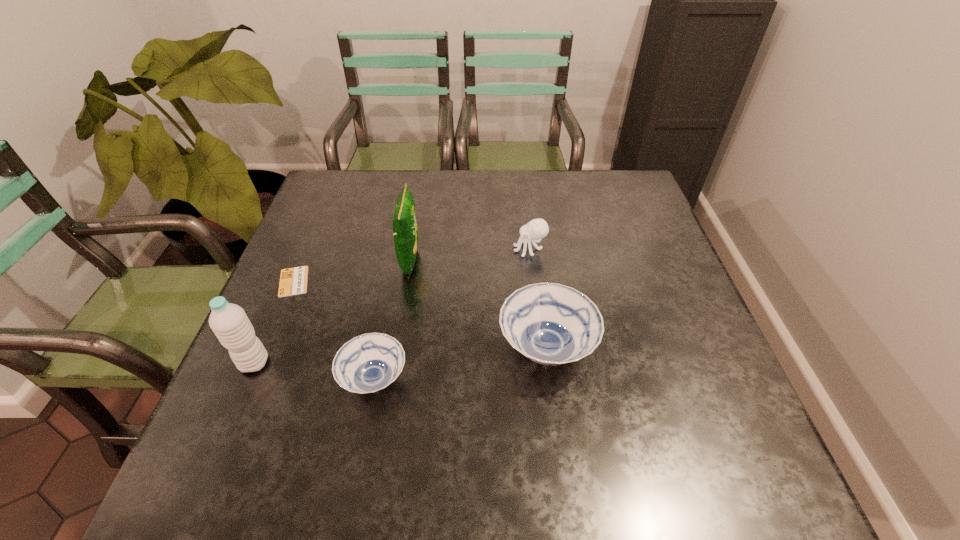
Image resolution: width=960 pixels, height=540 pixels. I want to click on vacant space in between the left soup bowl and the crisp (potato chip), so click(x=393, y=320).

Identify the location of free space between the crisp (potato chip) and the identity card. (352, 271).

Identify the location of empty location between the left soup bowl and the water bottle. (314, 371).

The width and height of the screenshot is (960, 540). I want to click on the closest object to the taller soup bowl, so click(537, 228).

The image size is (960, 540). Find the location of `object that is the fifth closest to the water bottle`. object that is the fifth closest to the water bottle is located at coordinates (537, 228).

You are a GUI agent. You are given a task and a screenshot of the screen. Output one action in this format:
    pyautogui.click(x=<x>, y=<y>)
    Task: Click on the vacant area in the image that satisfies the following two spatial constraints: 1. on the back side of the right soup bowl; 2. on the right side of the water bottle
    
    Given the screenshot: What is the action you would take?
    pyautogui.click(x=261, y=348)

Locate an element on the screen. vacant area that satisfies the following two spatial constraints: 1. on the back side of the water bottle; 2. on the left side of the shortest object is located at coordinates (289, 281).